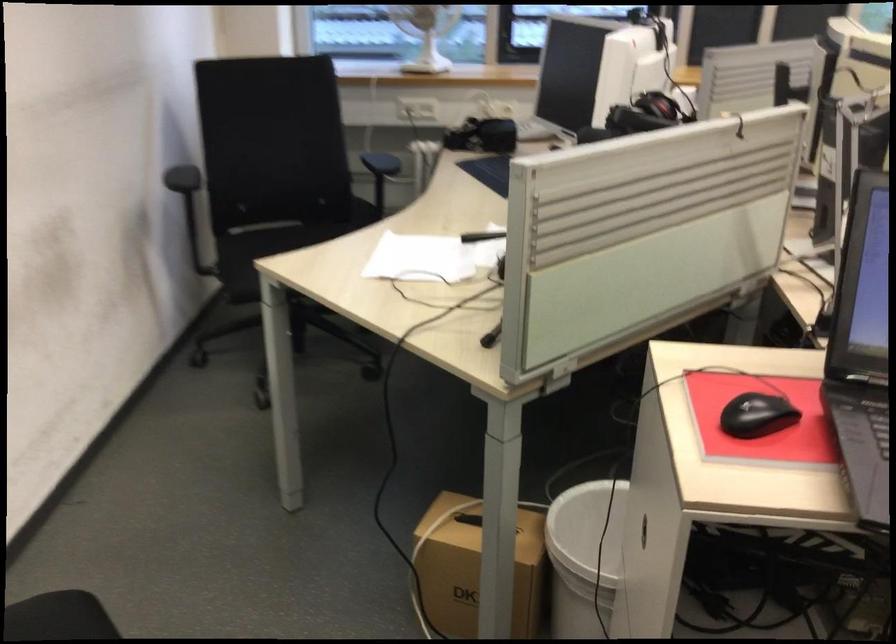
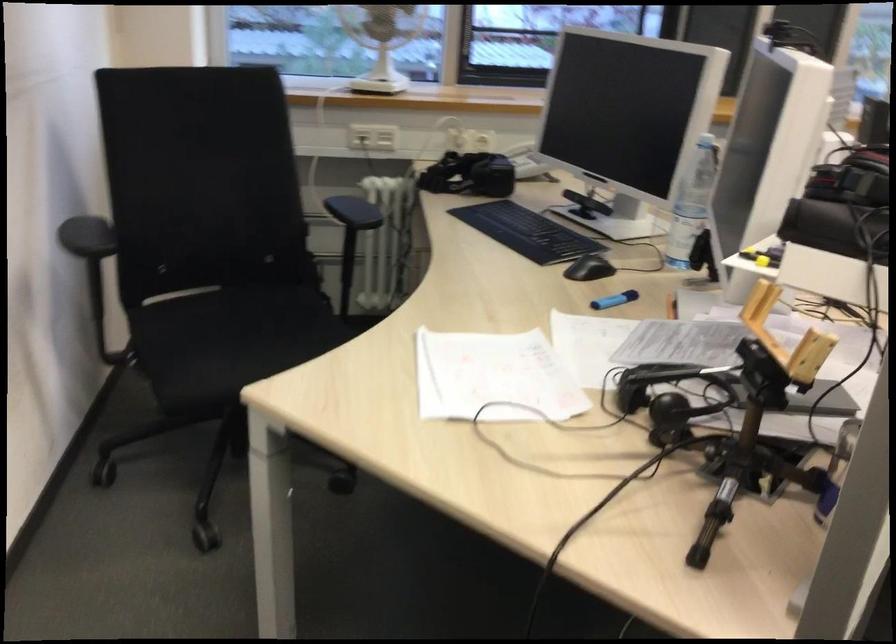
Question: The first image is from the beginning of the video and the second image is from the end. How did the camera likely rotate when shooting the video?

Choices:
 (A) Left
 (B) Right
 (C) Up
 (D) Down

Answer: (B)